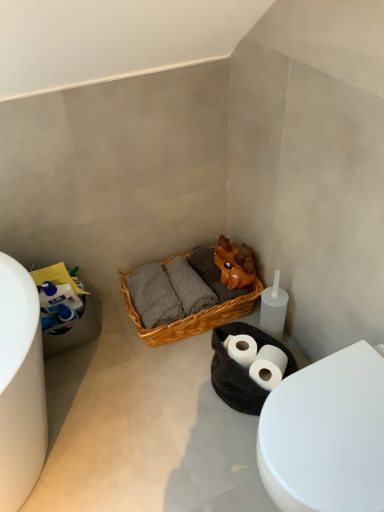
The image size is (384, 512). Identify the location of free space above white glossy toilet at lower right (from a real-world perspective). (337, 419).